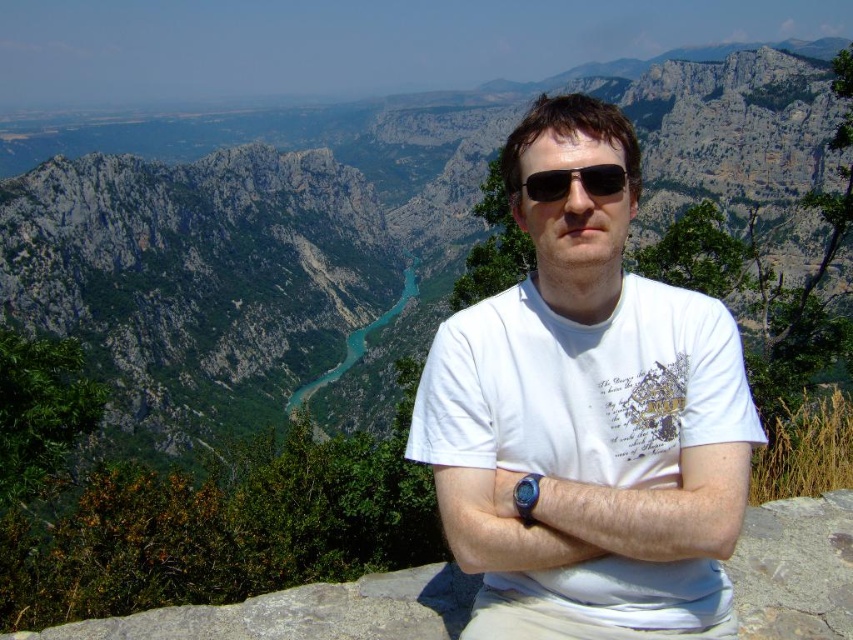
Which is above, gray rocky mountain at center or white cotton t-shirt at center?

Positioned higher is gray rocky mountain at center.

Can you confirm if gray rocky mountain at center is smaller than white cotton t-shirt at center?

No.

At what (x,y) coordinates should I click in order to perform the action: click on gray rocky mountain at center. Please return your answer as a coordinate pair (x, y). Looking at the image, I should click on tap(354, 228).

Is white cotton t-shirt at center positioned before black plastic sunglasses at center?

Yes, white cotton t-shirt at center is closer to the viewer.

Does white cotton t-shirt at center appear on the right side of black plastic sunglasses at center?

Indeed, white cotton t-shirt at center is positioned on the right side of black plastic sunglasses at center.

You are a GUI agent. You are given a task and a screenshot of the screen. Output one action in this format:
    pyautogui.click(x=<x>, y=<y>)
    Task: Click on the white cotton t-shirt at center
    This screenshot has height=640, width=853.
    Given the screenshot: What is the action you would take?
    pyautogui.click(x=587, y=419)

At what (x,y) coordinates should I click in order to perform the action: click on white cotton t-shirt at center. Please return your answer as a coordinate pair (x, y). The width and height of the screenshot is (853, 640). Looking at the image, I should click on (587, 419).

Between gray rocky mountain at center and black plastic sunglasses at center, which one has less height?

black plastic sunglasses at center is shorter.

Is gray rocky mountain at center to the right of black plastic sunglasses at center from the viewer's perspective?

Indeed, gray rocky mountain at center is positioned on the right side of black plastic sunglasses at center.

Is point (822, 118) farther from camera compared to point (547, 196)?

Yes.

Identify the location of gray rocky mountain at center. (354, 228).